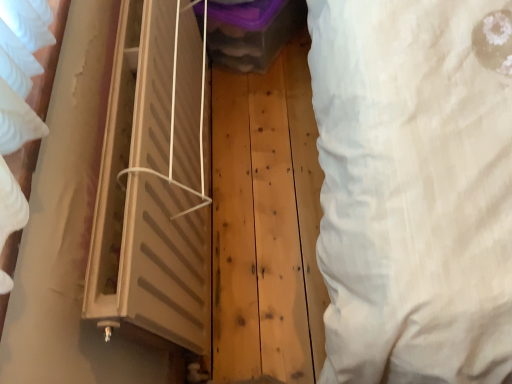
Question: Is beige plastic window at center at the right side of white fabric curtain at right?

Choices:
 (A) no
 (B) yes

Answer: (A)

Question: From the image's perspective, would you say beige plastic window at center is positioned over white fabric curtain at right?

Choices:
 (A) no
 (B) yes

Answer: (A)

Question: Is beige plastic window at center further to camera compared to white fabric curtain at right?

Choices:
 (A) yes
 (B) no

Answer: (A)

Question: Can you confirm if beige plastic window at center is wider than white fabric curtain at right?

Choices:
 (A) no
 (B) yes

Answer: (B)

Question: Does beige plastic window at center have a larger size compared to white fabric curtain at right?

Choices:
 (A) no
 (B) yes

Answer: (B)

Question: Is beige plastic window at center touching white fabric curtain at right?

Choices:
 (A) yes
 (B) no

Answer: (B)

Question: Is white fabric curtain at right further to the viewer compared to beige plastic window at center?

Choices:
 (A) yes
 (B) no

Answer: (B)

Question: Considering the relative sizes of white fabric curtain at right and beige plastic window at center in the image provided, is white fabric curtain at right shorter than beige plastic window at center?

Choices:
 (A) yes
 (B) no

Answer: (B)

Question: Does white fabric curtain at right have a smaller size compared to beige plastic window at center?

Choices:
 (A) yes
 (B) no

Answer: (A)

Question: Would you say white fabric curtain at right is outside beige plastic window at center?

Choices:
 (A) yes
 (B) no

Answer: (A)

Question: From a real-world perspective, is white fabric curtain at right positioned under beige plastic window at center based on gravity?

Choices:
 (A) no
 (B) yes

Answer: (A)

Question: Can you confirm if white fabric curtain at right is wider than beige plastic window at center?

Choices:
 (A) yes
 (B) no

Answer: (B)

Question: Looking at their shapes, would you say beige plastic window at center is wider or thinner than white fabric curtain at right?

Choices:
 (A) wide
 (B) thin

Answer: (A)